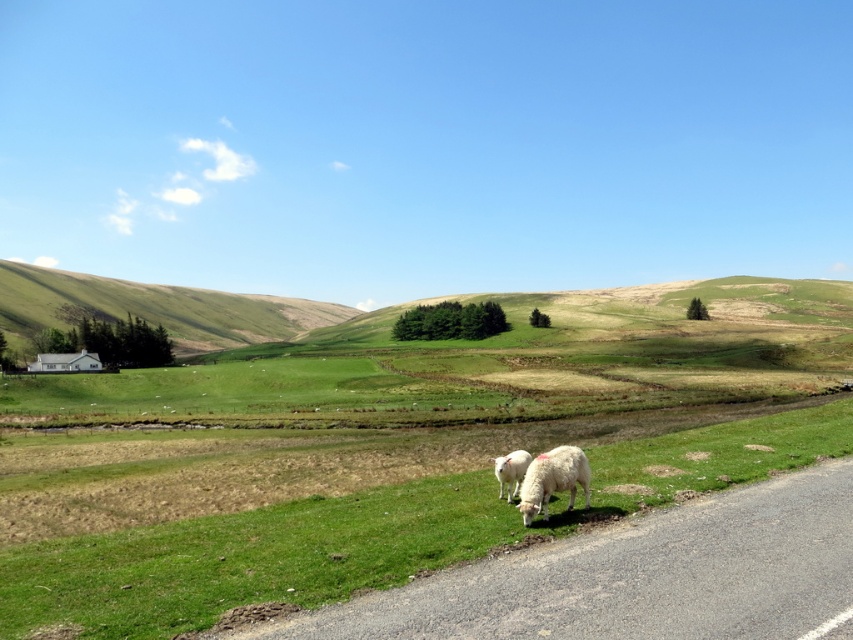
You are a drone operator trying to capture the best aerial shot of the scene. You need to ensure the green grassy hillside at left and the white woolly sheep at lower right are both visible. Which object should you focus on to frame the shot properly?

The green grassy hillside at left is larger in size than the white woolly sheep at lower right, so focusing on the green grassy hillside at left will help frame the shot properly while still including the smaller white woolly sheep at lower right.